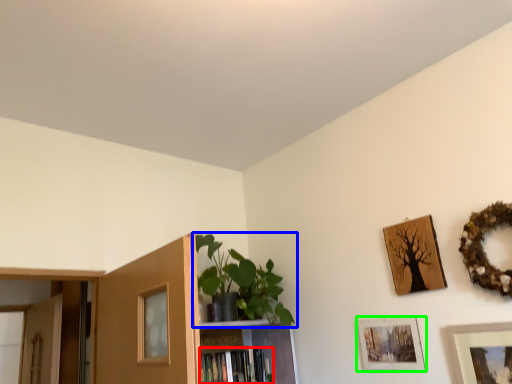
Question: Considering the real-world distances, which object is farthest from book (highlighted by a red box)? houseplant (highlighted by a blue box) or picture frame (highlighted by a green box)?

Choices:
 (A) houseplant
 (B) picture frame

Answer: (B)